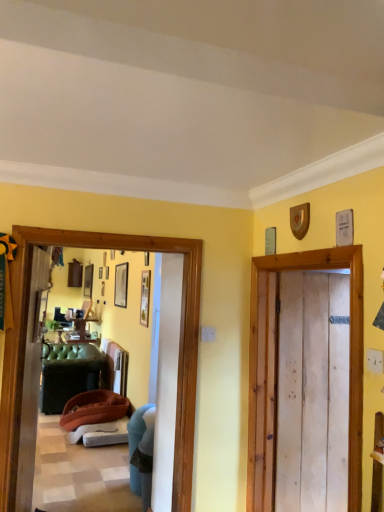
Image resolution: width=384 pixels, height=512 pixels. Describe the element at coordinates (121, 285) in the screenshot. I see `matte black picture frame at upper center, the 2th picture frame viewed from the front` at that location.

Find the location of a particular element. teal fabric chair at lower left is located at coordinates (141, 452).

Identify the location of wooden picture frame at center, the second picture frame from the left. Image resolution: width=384 pixels, height=512 pixels. (145, 297).

How much space does wooden picture frame at center, which is the second picture frame in back-to-front order, occupy horizontally?

wooden picture frame at center, which is the second picture frame in back-to-front order, is 1.58 inches in width.

You are a GUI agent. You are given a task and a screenshot of the screen. Output one action in this format:
    pyautogui.click(x=<x>, y=<y>)
    Task: Click on the green fabric couch at left
    Image resolution: width=384 pixels, height=512 pixels.
    Given the screenshot: What is the action you would take?
    pyautogui.click(x=31, y=381)

What do you see at coordinates (31, 381) in the screenshot? I see `green fabric couch at left` at bounding box center [31, 381].

Find the location of a particular element. This screenshot has width=384, height=512. brown fabric couch at left is located at coordinates (93, 413).

You are a GUI agent. You are given a task and a screenshot of the screen. Output one action in this format:
    pyautogui.click(x=<x>, y=<y>)
    Task: Click on the matte black picture frame at upper center, which is the 2th picture frame from right to left
    This screenshot has height=512, width=384.
    Given the screenshot: What is the action you would take?
    pyautogui.click(x=121, y=285)

From a real-world perspective, relative to teal fabric chair at lower left, is green fabric couch at left vertically above or below?

In terms of real-world spatial position, green fabric couch at left is above teal fabric chair at lower left.

Can you confirm if green fabric couch at left is wider than teal fabric chair at lower left?

No, green fabric couch at left is not wider than teal fabric chair at lower left.

What's the angular difference between green fabric couch at left and teal fabric chair at lower left's facing directions?

There is a 174-degree angle between the facing directions of green fabric couch at left and teal fabric chair at lower left.

Does natural wood door at right come behind teal fabric chair at lower left?

That is False.

Measure the distance between natural wood door at right and teal fabric chair at lower left.

They are 4.22 feet apart.

Which of these two, natural wood door at right or teal fabric chair at lower left, is bigger?

Bigger between the two is teal fabric chair at lower left.

Is teal fabric chair at lower left at the back of natural wood door at right?

No, natural wood door at right is not facing the opposite direction of teal fabric chair at lower left.

Based on the photo, is brown fabric couch at left closer to the viewer compared to teal fabric chair at lower left?

No, brown fabric couch at left is further to the viewer.

What are the coordinates of `couch behind the teal fabric chair at lower left` in the screenshot? It's located at (93, 413).

Is brown fabric couch at left situated inside teal fabric chair at lower left or outside?

brown fabric couch at left exists outside the volume of teal fabric chair at lower left.

How different are the orientations of brown fabric couch at left and teal fabric chair at lower left in degrees?

The angle between the facing direction of brown fabric couch at left and the facing direction of teal fabric chair at lower left is 0.00433 degrees.

Is green fabric couch at left next to brown fabric couch at left?

green fabric couch at left and brown fabric couch at left are not in contact.

From a real-world perspective, which object stands above the other?

green fabric couch at left, from a real-world perspective.

Which object is thinner, green fabric couch at left or brown fabric couch at left?

green fabric couch at left.

Which is farther from the camera, (37,353) or (114,411)?

The point (114,411) is behind.

What are the coordinates of `chair lying on the right of green fabric couch at left` in the screenshot? It's located at (141, 452).

Between teal fabric chair at lower left and green fabric couch at left, which one has more height?

Standing taller between the two is green fabric couch at left.

Which point is more distant from viewer, (140, 465) or (18, 454)?

Point (140, 465)

From the picture: From the image's perspective, which one is positioned higher, teal fabric chair at lower left or green fabric couch at left?

green fabric couch at left appears higher in the image.

Considering the positions of point (121, 280) and point (147, 270), is point (121, 280) closer or farther from the camera than point (147, 270)?

Point (121, 280).

Can you tell me how much matte black picture frame at upper center, which is the 2th picture frame from right to left, and wooden picture frame at center, positioned as the first picture frame in right-to-left order, differ in facing direction?

matte black picture frame at upper center, which is the 2th picture frame from right to left, and wooden picture frame at center, positioned as the first picture frame in right-to-left order, are facing 0.0228 degrees away from each other.

Find the location of a particular element. This screenshot has width=384, height=512. picture frame below the matte black picture frame at upper center, the 2th picture frame viewed from the front (from a real-world perspective) is located at coordinates (145, 297).

Is green fabric couch at left directly adjacent to wooden picture frame at center, positioned as the first picture frame in right-to-left order?

green fabric couch at left and wooden picture frame at center, positioned as the first picture frame in right-to-left order, are not in contact.

Considering the positions of point (36, 351) and point (146, 292), is point (36, 351) closer or farther from the camera than point (146, 292)?

Point (36, 351) appears to be closer to the viewer than point (146, 292).

From their relative heights in the image, would you say green fabric couch at left is taller or shorter than wooden picture frame at center, which is the 1th picture frame from front to back?

Clearly, green fabric couch at left is taller compared to wooden picture frame at center, which is the 1th picture frame from front to back.

What are the coordinates of `chair to the right of green fabric couch at left` in the screenshot? It's located at (141, 452).

This screenshot has height=512, width=384. I want to click on chair below the natural wood door at right (from the image's perspective), so click(x=141, y=452).

From the image, which object appears to be farther from matte black picture frame at upper center, the 1th picture frame positioned from the left, teal fabric chair at lower left or brown fabric couch at left?

teal fabric chair at lower left lies further to matte black picture frame at upper center, the 1th picture frame positioned from the left, than the other object.

Considering their positions, is brown fabric couch at left positioned closer to teal fabric chair at lower left than green fabric couch at left?

green fabric couch at left is closer to teal fabric chair at lower left.

Estimate the real-world distances between objects in this image. Which object is closer to matte black picture frame at upper center, the 2th picture frame viewed from the front, wooden picture frame at center, positioned as the first picture frame in right-to-left order, or green fabric couch at left?

wooden picture frame at center, positioned as the first picture frame in right-to-left order, is positioned closer to the anchor matte black picture frame at upper center, the 2th picture frame viewed from the front.

When comparing their distances from teal fabric chair at lower left, does wooden picture frame at center, which is the second picture frame in back-to-front order, or matte black picture frame at upper center, the 2th picture frame viewed from the front, seem closer?

wooden picture frame at center, which is the second picture frame in back-to-front order.

When comparing their distances from matte black picture frame at upper center, acting as the first picture frame starting from the back, does teal fabric chair at lower left or natural wood door at right seem closer?

teal fabric chair at lower left lies closer to matte black picture frame at upper center, acting as the first picture frame starting from the back, than the other object.

Which object lies further to the anchor point green fabric couch at left, teal fabric chair at lower left or brown fabric couch at left?

brown fabric couch at left is further to green fabric couch at left.

Considering their positions, is wooden picture frame at center, which is the 1th picture frame from front to back, positioned further to matte black picture frame at upper center, which is the 2th picture frame from right to left, than teal fabric chair at lower left?

teal fabric chair at lower left lies further to matte black picture frame at upper center, which is the 2th picture frame from right to left, than the other object.

From the image, which object appears to be farther from wooden picture frame at center, which is the 1th picture frame from front to back, brown fabric couch at left or natural wood door at right?

natural wood door at right is further to wooden picture frame at center, which is the 1th picture frame from front to back.

The width and height of the screenshot is (384, 512). I want to click on couch positioned between green fabric couch at left and wooden picture frame at center, which is the second picture frame in back-to-front order, from near to far, so click(x=93, y=413).

This screenshot has height=512, width=384. Identify the location of chair located between natural wood door at right and brown fabric couch at left in the depth direction. (141, 452).

Image resolution: width=384 pixels, height=512 pixels. In order to click on chair between green fabric couch at left and matte black picture frame at upper center, which is the 2th picture frame from right to left, in the front-back direction in this screenshot , I will do `click(141, 452)`.

You are a GUI agent. You are given a task and a screenshot of the screen. Output one action in this format:
    pyautogui.click(x=<x>, y=<y>)
    Task: Click on the chair situated between green fabric couch at left and natural wood door at right from left to right
    This screenshot has width=384, height=512.
    Given the screenshot: What is the action you would take?
    pyautogui.click(x=141, y=452)